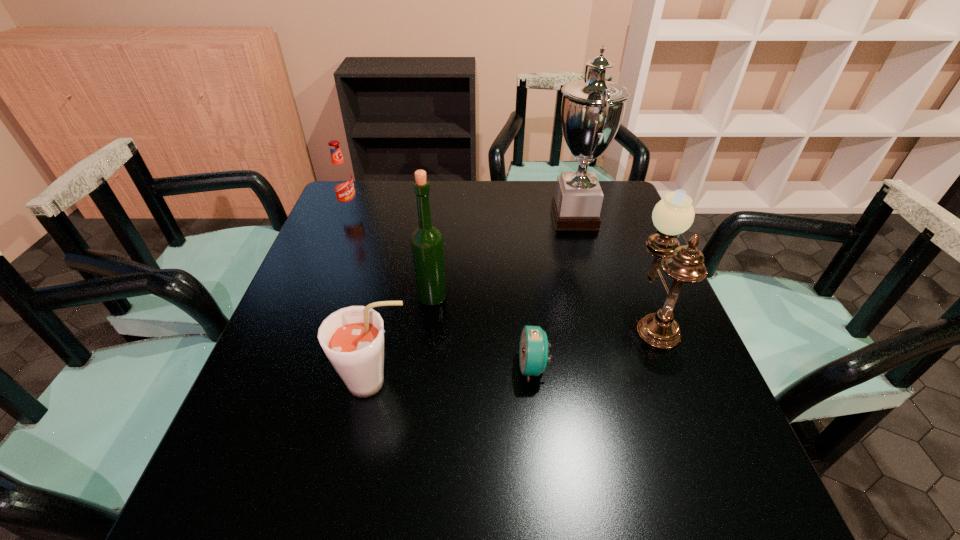
Find the location of a particular element. The height and width of the screenshot is (540, 960). the tallest object is located at coordinates (592, 110).

Where is `liquor`? The width and height of the screenshot is (960, 540). liquor is located at coordinates (427, 246).

At what (x,y) coordinates should I click in order to perform the action: click on oil lamp. Please return your answer as a coordinate pair (x, y). Looking at the image, I should click on (673, 215).

I want to click on the farther root beer, so pyautogui.click(x=341, y=177).

You are a GUI agent. You are given a task and a screenshot of the screen. Output one action in this format:
    pyautogui.click(x=<x>, y=<y>)
    Task: Click on the leftmost object
    The height and width of the screenshot is (540, 960).
    Given the screenshot: What is the action you would take?
    pyautogui.click(x=341, y=177)

Locate an element on the screen. This screenshot has width=960, height=540. the right root beer is located at coordinates tap(352, 338).

Identify the location of the shortest object. (533, 354).

Find the location of `the third object from right to left`. the third object from right to left is located at coordinates (533, 354).

Locate an element on the screen. Image resolution: width=960 pixels, height=540 pixels. vacant space located at the front view of the tallest object is located at coordinates (428, 217).

The image size is (960, 540). In order to click on free space located 0.290m at the front view of the tallest object in this screenshot , I will do `click(451, 217)`.